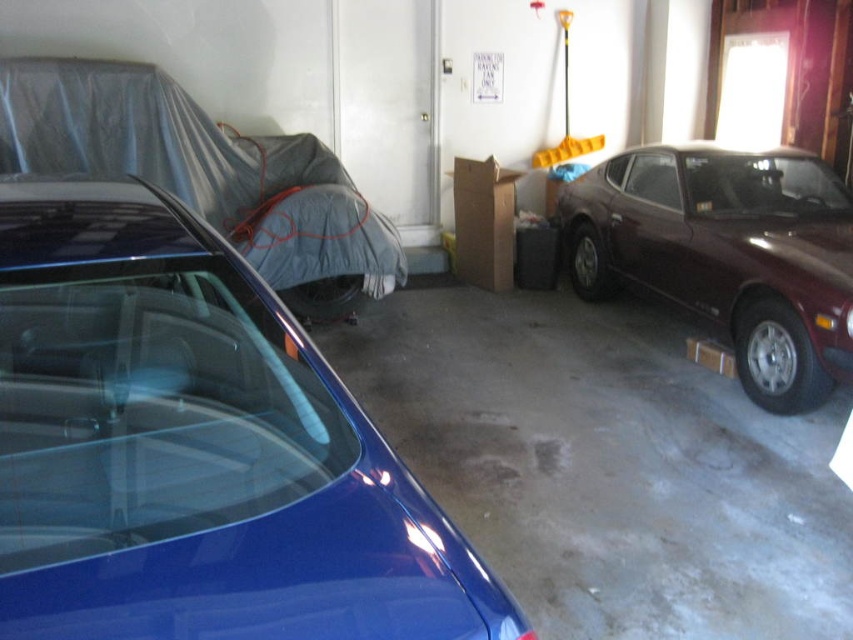
Question: Can you confirm if glossy blue car at center is positioned to the right of maroon metallic car at right?

Choices:
 (A) no
 (B) yes

Answer: (A)

Question: Can you confirm if glossy blue car at center is bigger than maroon metallic car at right?

Choices:
 (A) yes
 (B) no

Answer: (B)

Question: Which of the following is the farthest from the observer?

Choices:
 (A) (213, 577)
 (B) (717, 161)

Answer: (B)

Question: Which object is closer to the camera taking this photo?

Choices:
 (A) maroon metallic car at right
 (B) glossy blue car at center

Answer: (B)

Question: Which of the following is the closest to the observer?

Choices:
 (A) glossy blue car at center
 (B) maroon metallic car at right

Answer: (A)

Question: Does glossy blue car at center have a greater width compared to maroon metallic car at right?

Choices:
 (A) yes
 (B) no

Answer: (B)